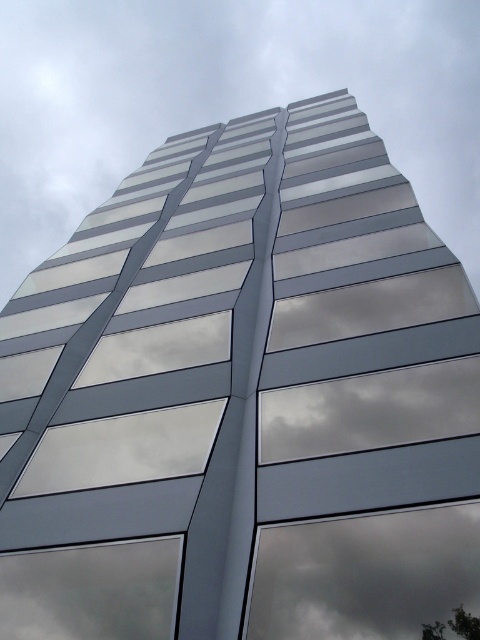
Question: Is gray/metallic cloud at center above transparent glass window at lower left?

Choices:
 (A) no
 (B) yes

Answer: (B)

Question: Does gray/metallic cloud at center have a lesser width compared to dark gray reflective cloud at center?

Choices:
 (A) yes
 (B) no

Answer: (B)

Question: Which object is the closest to the transparent glass window at lower left?

Choices:
 (A) gray/metallic cloud at center
 (B) dark gray reflective cloud at center

Answer: (B)

Question: Is gray/metallic cloud at center in front of transparent glass window at lower left?

Choices:
 (A) no
 (B) yes

Answer: (A)

Question: Which point is closer to the camera?

Choices:
 (A) dark gray reflective cloud at center
 (B) gray/metallic cloud at center
 (C) transparent glass window at lower left

Answer: (A)

Question: Among these objects, which one is farthest from the camera?

Choices:
 (A) transparent glass window at lower left
 (B) dark gray reflective cloud at center
 (C) gray/metallic cloud at center

Answer: (C)